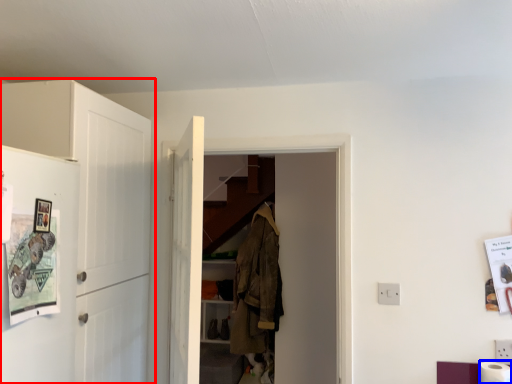
Question: Which of the following is the farthest to the observer, cabinetry (highlighted by a red box) or toilet paper (highlighted by a blue box)?

Choices:
 (A) cabinetry
 (B) toilet paper

Answer: (B)